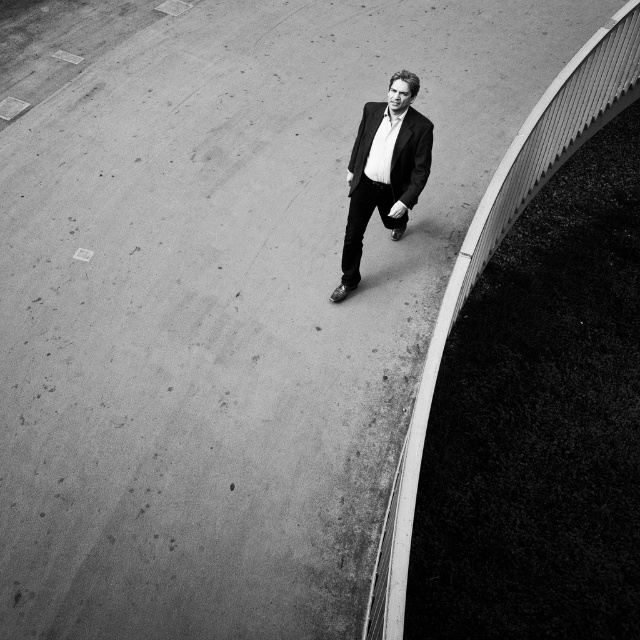
Question: Considering the relative positions of smooth concrete curb at right and matte black suit at center in the image provided, where is smooth concrete curb at right located with respect to matte black suit at center?

Choices:
 (A) left
 (B) right

Answer: (A)

Question: Does smooth concrete curb at right lie in front of matte black suit at center?

Choices:
 (A) yes
 (B) no

Answer: (A)

Question: Is smooth concrete curb at right bigger than matte black suit at center?

Choices:
 (A) no
 (B) yes

Answer: (A)

Question: Among these objects, which one is farthest from the camera?

Choices:
 (A) smooth concrete curb at right
 (B) matte black suit at center

Answer: (B)